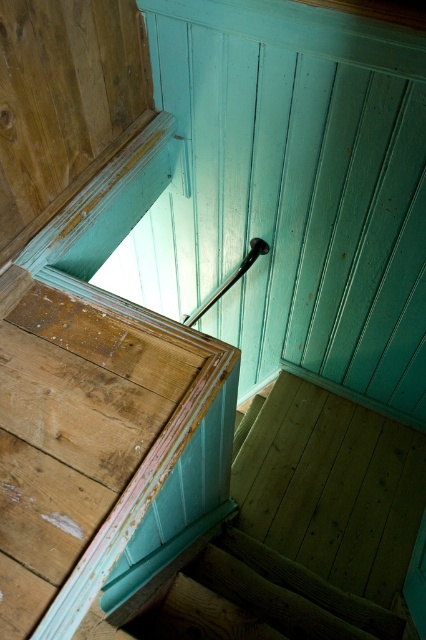
The height and width of the screenshot is (640, 426). What do you see at coordinates (103, 452) in the screenshot?
I see `wooden handrail at upper left` at bounding box center [103, 452].

Is wooden handrail at upper left bigger than black glossy rail at upper center?

Yes.

Locate an element on the screen. wooden handrail at upper left is located at coordinates (103, 452).

Is wooden at center bigger than black glossy rail at upper center?

Yes, wooden at center is bigger than black glossy rail at upper center.

Can you confirm if wooden at center is thinner than black glossy rail at upper center?

Incorrect, wooden at center's width is not less than black glossy rail at upper center's.

Which is in front, point (218, 550) or point (261, 252)?

Point (218, 550) is in front.

In order to click on wooden at center in this screenshot , I will do `click(259, 600)`.

Does wooden handrail at upper left appear on the right side of wooden at center?

No, wooden handrail at upper left is not to the right of wooden at center.

Is wooden handrail at upper left closer to camera compared to wooden at center?

Yes.

Where is `wooden handrail at upper left`? Image resolution: width=426 pixels, height=640 pixels. wooden handrail at upper left is located at coordinates (103, 452).